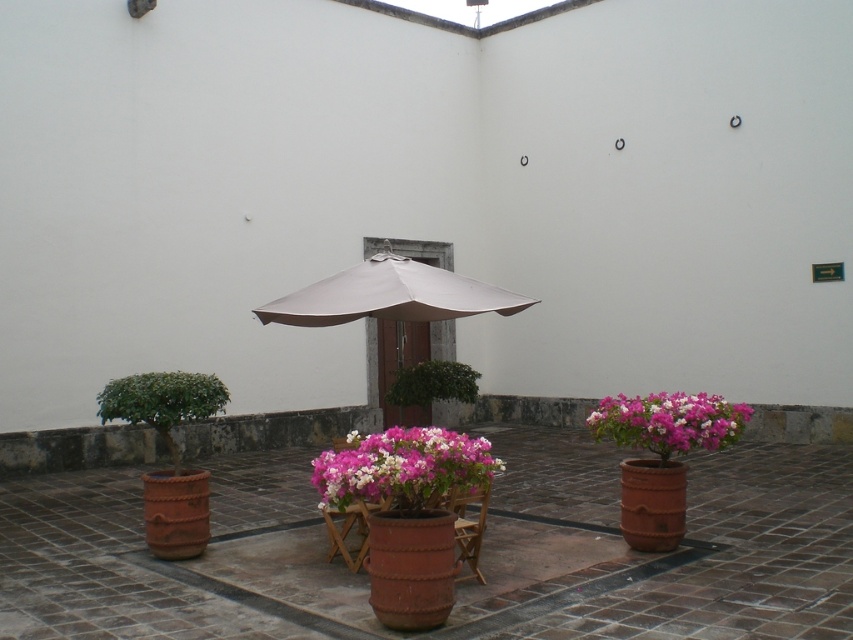
What do you see at coordinates (390, 296) in the screenshot?
I see `beige fabric umbrella at center` at bounding box center [390, 296].

Which is more to the right, beige fabric umbrella at center or pink matte flower pot at right?

From the viewer's perspective, pink matte flower pot at right appears more on the right side.

Describe the element at coordinates (390, 296) in the screenshot. I see `beige fabric umbrella at center` at that location.

Identify the location of beige fabric umbrella at center. Image resolution: width=853 pixels, height=640 pixels. (390, 296).

Between pink matte flowers at center and pink matte flower pot at right, which one has more height?

pink matte flowers at center

Based on the photo, is pink matte flowers at center positioned behind pink matte flower pot at right?

No, it is not.

What do you see at coordinates (403, 467) in the screenshot? The height and width of the screenshot is (640, 853). I see `pink matte flowers at center` at bounding box center [403, 467].

The height and width of the screenshot is (640, 853). I want to click on pink matte flowers at center, so click(403, 467).

Is point (387, 278) positioned before point (395, 428)?

Yes, it is.

The image size is (853, 640). Describe the element at coordinates (390, 296) in the screenshot. I see `beige fabric umbrella at center` at that location.

Does point (349, 304) come behind point (373, 486)?

Yes, it is.

Find the location of a particular element. This screenshot has width=853, height=640. beige fabric umbrella at center is located at coordinates (390, 296).